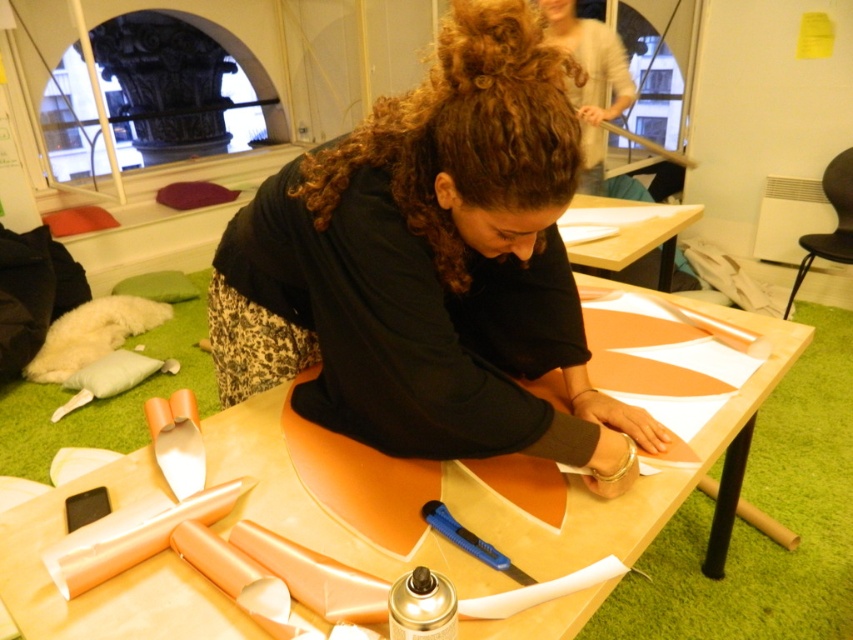
Can you confirm if matte orange table at center is positioned to the left of matte white shirt at upper center?

Indeed, matte orange table at center is positioned on the left side of matte white shirt at upper center.

Identify the location of matte orange table at center. This screenshot has width=853, height=640. point(109,579).

Where is `matte orange table at center`? matte orange table at center is located at coordinates [109, 579].

What are the coordinates of `matte orange table at center` in the screenshot? It's located at (109, 579).

Is black matte shirt at center taller than wooden table at upper center?

Yes, black matte shirt at center is taller than wooden table at upper center.

Can you confirm if black matte shirt at center is wider than wooden table at upper center?

Yes.

At what (x,y) coordinates should I click in order to perform the action: click on black matte shirt at center. Please return your answer as a coordinate pair (x, y). Looking at the image, I should click on (431, 268).

Is black matte shirt at center to the left of matte white shirt at upper center from the viewer's perspective?

Yes, black matte shirt at center is to the left of matte white shirt at upper center.

Is point (379, 221) farther from camera compared to point (601, 122)?

No.

Does point (544, 129) lie in front of point (605, 120)?

That is True.

Image resolution: width=853 pixels, height=640 pixels. I want to click on black matte shirt at center, so click(431, 268).